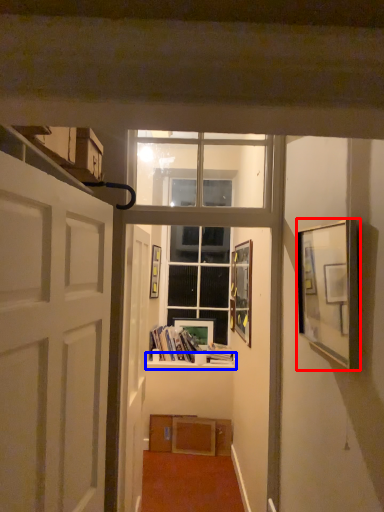
Question: Among these objects, which one is nearest to the camera, picture frame (highlighted by a red box) or window sill (highlighted by a blue box)?

Choices:
 (A) picture frame
 (B) window sill

Answer: (A)